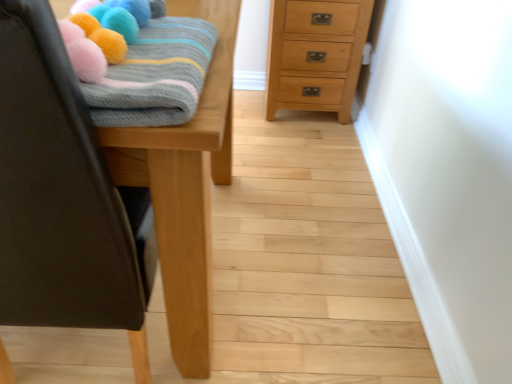
This screenshot has width=512, height=384. Identify the location of wooden table at left. (186, 188).

The width and height of the screenshot is (512, 384). Describe the element at coordinates (155, 76) in the screenshot. I see `knitted woolen blanket at upper left` at that location.

What do you see at coordinates (315, 54) in the screenshot?
I see `natural wood chest of drawers at upper right` at bounding box center [315, 54].

The image size is (512, 384). I want to click on wooden table at left, so click(x=186, y=188).

Can you confirm if wooden table at left is taller than natural wood chest of drawers at upper right?

Yes.

You are a GUI agent. You are given a task and a screenshot of the screen. Output one action in this format:
    pyautogui.click(x=<x>, y=<y>)
    Task: Click on the chest of drawers on the right of wooden table at left
    This screenshot has height=384, width=512.
    Given the screenshot: What is the action you would take?
    pyautogui.click(x=315, y=54)

Between wooden table at left and natural wood chest of drawers at upper right, which one has larger size?

wooden table at left is bigger.

Considering the positions of points (205, 211) and (285, 25), is point (205, 211) closer to camera compared to point (285, 25)?

Yes, it is in front of point (285, 25).

Is knitted woolen blanket at upper left in contact with natural wood chest of drawers at upper right?

They are not placed beside each other.

Is natural wood chest of drawers at upper right completely or partially inside knitted woolen blanket at upper left?

No.

Measure the distance between knitted woolen blanket at upper left and natural wood chest of drawers at upper right.

The distance of knitted woolen blanket at upper left from natural wood chest of drawers at upper right is 1.33 meters.

Between knitted woolen blanket at upper left and natural wood chest of drawers at upper right, which one has larger width?

With larger width is natural wood chest of drawers at upper right.

Considering the relative sizes of wooden table at left and knitted woolen blanket at upper left in the image provided, is wooden table at left bigger than knitted woolen blanket at upper left?

Correct, wooden table at left is larger in size than knitted woolen blanket at upper left.

From a real-world perspective, is wooden table at left positioned over knitted woolen blanket at upper left based on gravity?

Actually, wooden table at left is physically below knitted woolen blanket at upper left in the real world.

Is wooden table at left completely or partially outside of knitted woolen blanket at upper left?

wooden table at left is positioned outside knitted woolen blanket at upper left.

Which point is more distant from viewer, (281, 47) or (219, 109)?

Positioned behind is point (281, 47).

Consider the image. Is natural wood chest of drawers at upper right bigger than wooden table at left?

Actually, natural wood chest of drawers at upper right might be smaller than wooden table at left.

Locate an element on the screen. This screenshot has height=384, width=512. furniture above the natural wood chest of drawers at upper right (from a real-world perspective) is located at coordinates (186, 188).

From the image's perspective, which is below, natural wood chest of drawers at upper right or wooden table at left?

wooden table at left.

You are a GUI agent. You are given a task and a screenshot of the screen. Output one action in this format:
    pyautogui.click(x=<x>, y=<y>)
    Task: Click on the bath towel in front of the natural wood chest of drawers at upper right
    Image resolution: width=512 pixels, height=384 pixels.
    Given the screenshot: What is the action you would take?
    pyautogui.click(x=155, y=76)

From a real-world perspective, between natural wood chest of drawers at upper right and knitted woolen blanket at upper left, who is vertically lower?

natural wood chest of drawers at upper right is physically lower.

Considering the sizes of objects natural wood chest of drawers at upper right and knitted woolen blanket at upper left in the image provided, who is smaller, natural wood chest of drawers at upper right or knitted woolen blanket at upper left?

knitted woolen blanket at upper left.

From the image's perspective, would you say knitted woolen blanket at upper left is positioned over wooden table at left?

Yes, from the image's perspective, knitted woolen blanket at upper left is above wooden table at left.

In the scene shown: Can you confirm if knitted woolen blanket at upper left is shorter than wooden table at left?

Correct, knitted woolen blanket at upper left is not as tall as wooden table at left.

The width and height of the screenshot is (512, 384). I want to click on bath towel above the wooden table at left (from the image's perspective), so click(x=155, y=76).

Would you say knitted woolen blanket at upper left is to the left or to the right of wooden table at left in the picture?

Based on their positions, knitted woolen blanket at upper left is located to the right of wooden table at left.

Locate an element on the screen. furniture above the natural wood chest of drawers at upper right (from a real-world perspective) is located at coordinates (186, 188).

Identify the location of chest of drawers above the knitted woolen blanket at upper left (from the image's perspective). (315, 54).

Considering their positions, is knitted woolen blanket at upper left positioned closer to natural wood chest of drawers at upper right than wooden table at left?

wooden table at left.

Looking at the image, which one is located closer to knitted woolen blanket at upper left, natural wood chest of drawers at upper right or wooden table at left?

wooden table at left.

Considering their positions, is natural wood chest of drawers at upper right positioned closer to wooden table at left than knitted woolen blanket at upper left?

Based on the image, knitted woolen blanket at upper left appears to be nearer to wooden table at left.

Looking at the image, which one is located further to knitted woolen blanket at upper left, wooden table at left or natural wood chest of drawers at upper right?

The object further to knitted woolen blanket at upper left is natural wood chest of drawers at upper right.

Considering their positions, is knitted woolen blanket at upper left positioned further to wooden table at left than natural wood chest of drawers at upper right?

natural wood chest of drawers at upper right is positioned further to the anchor wooden table at left.

Considering their positions, is wooden table at left positioned further to natural wood chest of drawers at upper right than knitted woolen blanket at upper left?

knitted woolen blanket at upper left lies further to natural wood chest of drawers at upper right than the other object.

The image size is (512, 384). Identify the location of furniture located between knitted woolen blanket at upper left and natural wood chest of drawers at upper right in the depth direction. click(186, 188).